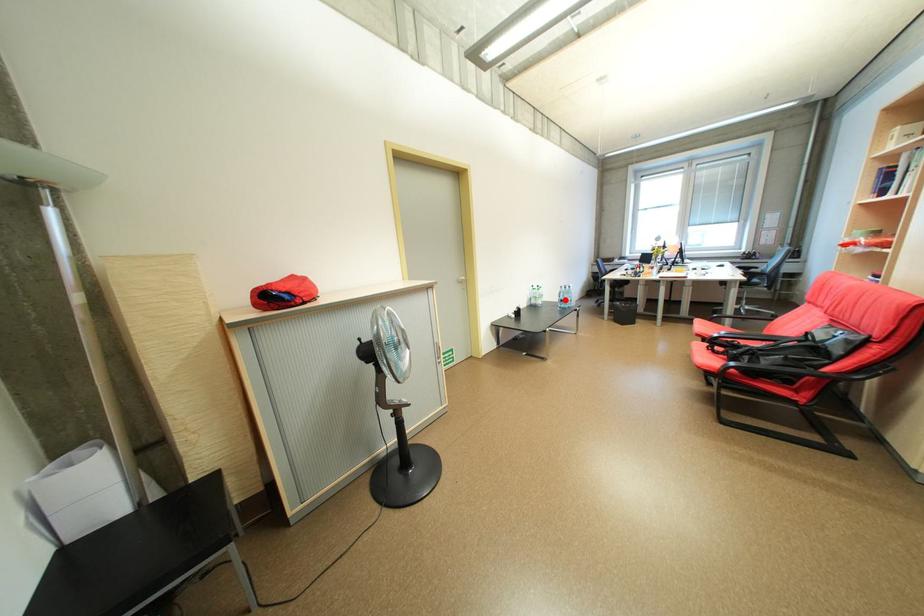
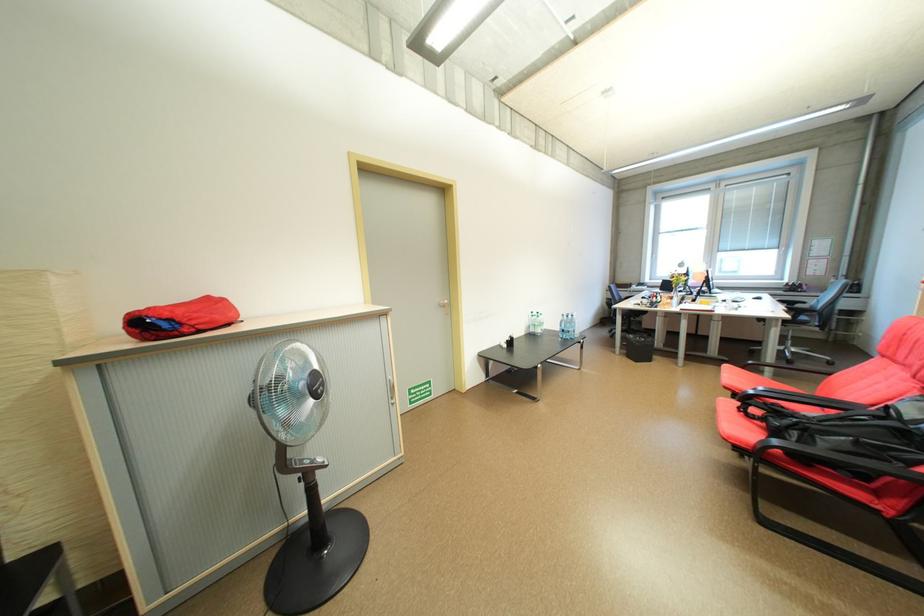
Locate, in the second image, the point that corresponds to the highlighted location in the first image.

(566, 329)